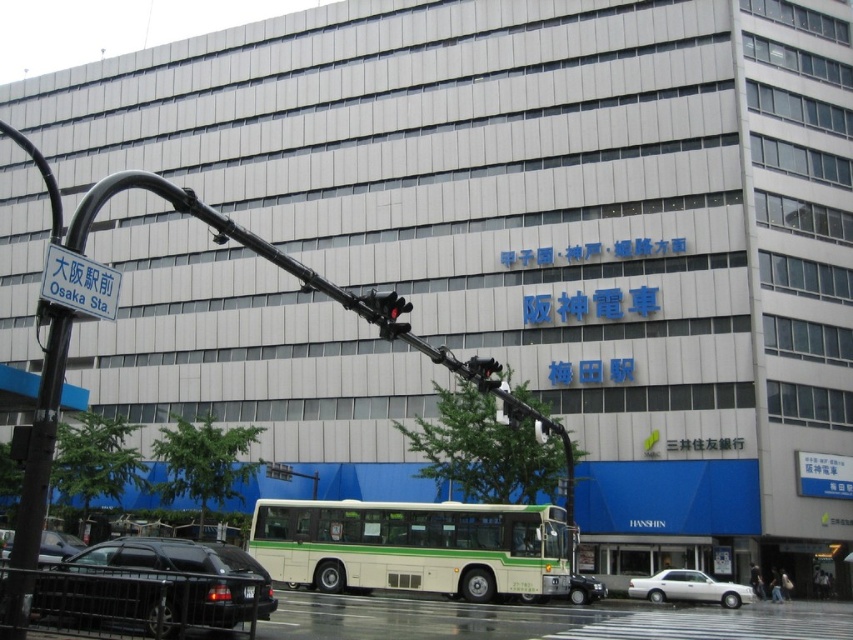
Question: From the image, what is the correct spatial relationship of white plastic street sign at upper left in relation to matte black car at lower left?

Choices:
 (A) right
 (B) left

Answer: (A)

Question: Estimate the real-world distances between objects in this image. Which object is closer to the white matte sedan at center?

Choices:
 (A) black matte sedan at lower left
 (B) black plastic traffic light at center
 (C) white/green painted bus at center

Answer: (C)

Question: Estimate the real-world distances between objects in this image. Which object is farther from the matte black car at lower left?

Choices:
 (A) red glass traffic light at center
 (B) white plastic street sign at upper left
 (C) black matte sedan at lower left

Answer: (B)

Question: Which point appears farthest from the camera in this image?

Choices:
 (A) (73, 538)
 (B) (482, 374)
 (C) (674, 572)

Answer: (C)

Question: Does black matte sedan at lower left have a larger size compared to white plastic street sign at upper left?

Choices:
 (A) no
 (B) yes

Answer: (B)

Question: Does black matte sedan at lower left appear on the right side of matte black car at lower left?

Choices:
 (A) no
 (B) yes

Answer: (B)